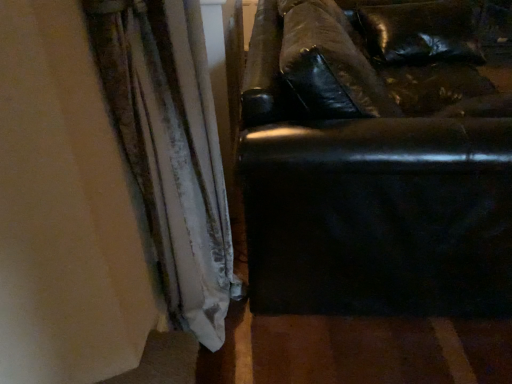
Question: From the image's perspective, would you say velvet-like white curtain at left is positioned over black leather couch at right?

Choices:
 (A) yes
 (B) no

Answer: (B)

Question: From the image's perspective, is velvet-like white curtain at left below black leather couch at right?

Choices:
 (A) no
 (B) yes

Answer: (B)

Question: Is velvet-like white curtain at left turned away from black leather couch at right?

Choices:
 (A) no
 (B) yes

Answer: (A)

Question: Is velvet-like white curtain at left not near black leather couch at right?

Choices:
 (A) no
 (B) yes

Answer: (A)

Question: Would you say velvet-like white curtain at left is outside black leather couch at right?

Choices:
 (A) no
 (B) yes

Answer: (B)

Question: Considering the relative positions of velvet-like white curtain at left and black leather couch at right in the image provided, is velvet-like white curtain at left to the left of black leather couch at right from the viewer's perspective?

Choices:
 (A) no
 (B) yes

Answer: (B)

Question: Does black leather couch at right have a greater width compared to velvet-like white curtain at left?

Choices:
 (A) no
 (B) yes

Answer: (B)

Question: Is black leather couch at right far away from velvet-like white curtain at left?

Choices:
 (A) no
 (B) yes

Answer: (A)

Question: Is black leather couch at right surrounding velvet-like white curtain at left?

Choices:
 (A) no
 (B) yes

Answer: (A)

Question: Can you confirm if black leather couch at right is taller than velvet-like white curtain at left?

Choices:
 (A) yes
 (B) no

Answer: (B)

Question: Can you confirm if black leather couch at right is positioned to the left of velvet-like white curtain at left?

Choices:
 (A) no
 (B) yes

Answer: (A)

Question: From a real-world perspective, is black leather couch at right physically above velvet-like white curtain at left?

Choices:
 (A) no
 (B) yes

Answer: (A)

Question: Would you say velvet-like white curtain at left is to the left or to the right of black leather couch at right in the picture?

Choices:
 (A) left
 (B) right

Answer: (A)